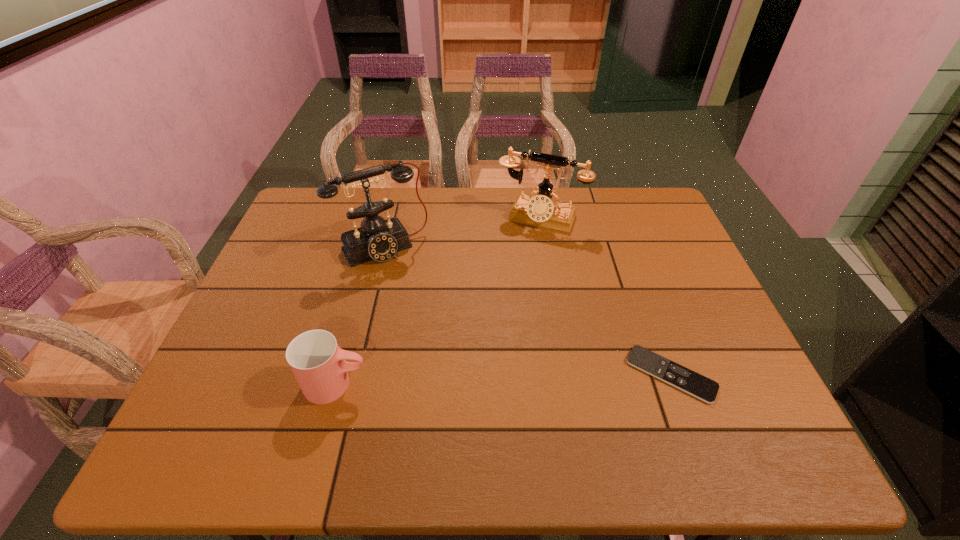
You are a GUI agent. You are given a task and a screenshot of the screen. Output one action in this format:
    pyautogui.click(x=<x>, y=<y>)
    Task: Click on the vacant space at the left edge of the desktop
    Image resolution: width=960 pixels, height=540 pixels.
    Given the screenshot: What is the action you would take?
    pyautogui.click(x=273, y=252)

Image resolution: width=960 pixels, height=540 pixels. I want to click on vacant area at the right edge, so click(x=730, y=367).

This screenshot has height=540, width=960. Find the location of `vacant space at the far left corner of the desktop`. vacant space at the far left corner of the desktop is located at coordinates (301, 199).

This screenshot has height=540, width=960. What are the coordinates of `vacant space at the far right corner of the desktop` in the screenshot? It's located at (642, 228).

In the image, there is a desktop. Where is `vacant area at the near right corner`? vacant area at the near right corner is located at coordinates (733, 397).

At what (x,y) coordinates should I click in order to perform the action: click on vacant space in between the left telephone and the second shortest object. Please return your answer as a coordinate pair (x, y). Image resolution: width=960 pixels, height=540 pixels. Looking at the image, I should click on (360, 316).

Where is `free space between the rightmost object and the second tallest object`? free space between the rightmost object and the second tallest object is located at coordinates (606, 296).

Locate an element on the screen. This screenshot has width=960, height=540. blank region between the third object from left to right and the rightmost object is located at coordinates (606, 296).

Locate an element on the screen. Image resolution: width=960 pixels, height=540 pixels. vacant space in between the second object from right to left and the left telephone is located at coordinates (462, 233).

Locate an element on the screen. This screenshot has width=960, height=540. empty space between the left telephone and the second object from right to left is located at coordinates (462, 233).